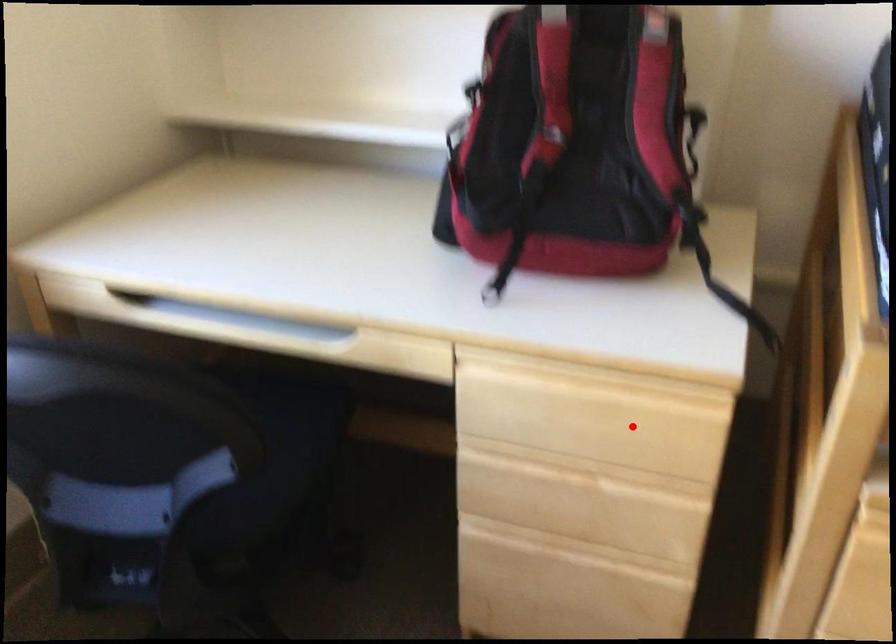
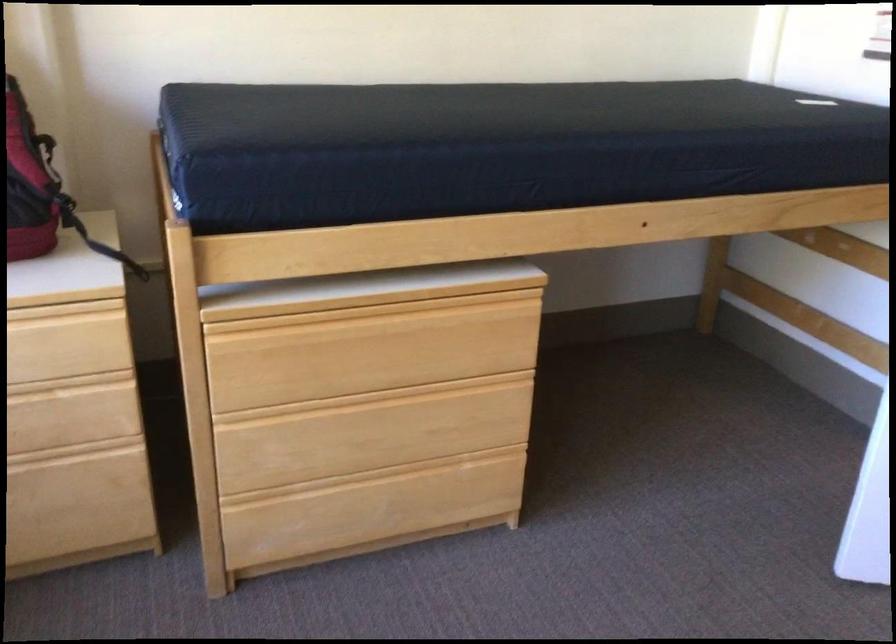
Find the pixel in the second image that matches the highlighted location in the first image.

(67, 348)